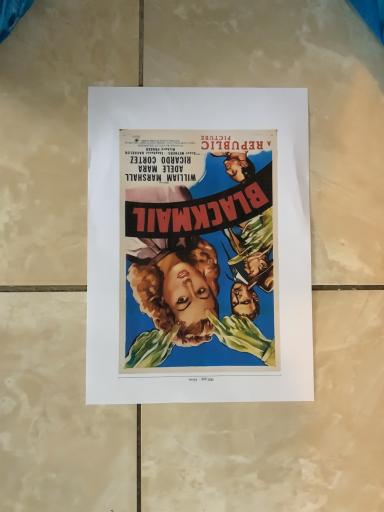
At what (x,y) coordinates should I click in order to perform the action: click on matte paper poster at center. Please return your answer as a coordinate pair (x, y). The height and width of the screenshot is (512, 384). Looking at the image, I should click on 119,229.

What do you see at coordinates (119, 229) in the screenshot? The image size is (384, 512). I see `matte paper poster at center` at bounding box center [119, 229].

I want to click on matte paper poster at center, so click(119, 229).